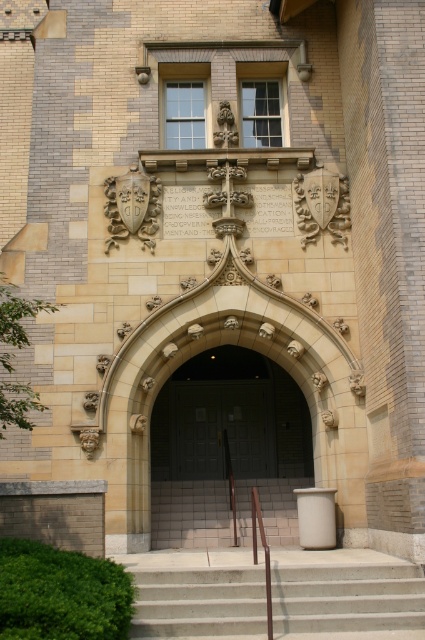
Question: Among these objects, which one is nearest to the camera?

Choices:
 (A) brown polished wood handrail at center
 (B) dark gray wooden door at center
 (C) dark wood door at center
 (D) concrete stairs at lower center

Answer: (A)

Question: Can you confirm if concrete stairs at lower center is positioned to the right of brown polished wood handrail at center?

Choices:
 (A) yes
 (B) no

Answer: (A)

Question: Can you confirm if concrete stairs at lower center is positioned above dark wood door at center?

Choices:
 (A) yes
 (B) no

Answer: (B)

Question: Does dark gray wooden door at center have a larger size compared to brown polished wood handrail at center?

Choices:
 (A) no
 (B) yes

Answer: (B)

Question: Which object appears farthest from the camera in this image?

Choices:
 (A) brown polished wood handrail at center
 (B) dark gray wooden door at center
 (C) concrete stairs at lower center
 (D) dark wood door at center

Answer: (D)

Question: Which point is farther to the camera?

Choices:
 (A) concrete stairs at lower center
 (B) brown polished wood handrail at center

Answer: (A)